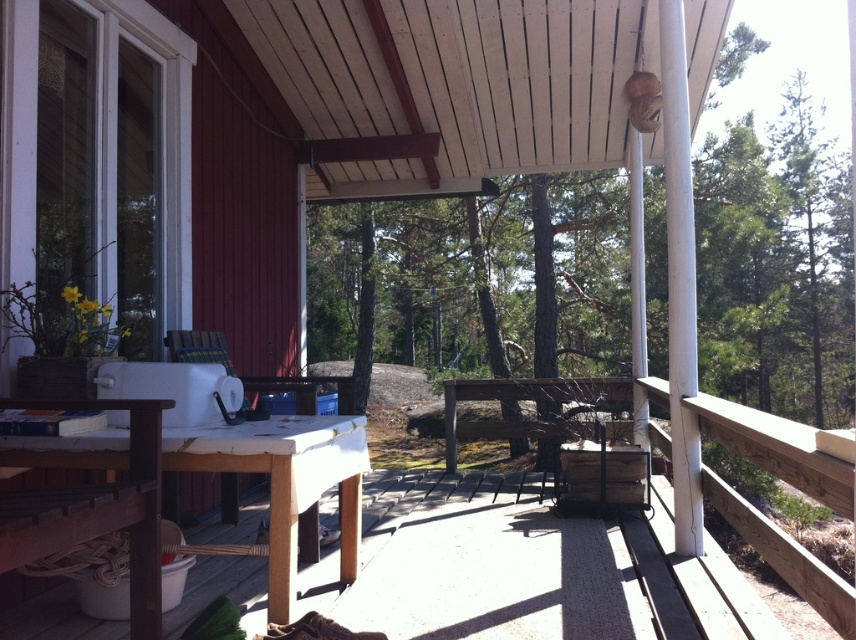
Based on the photo, between wooden table at center and white matte table at lower left, which one has more height?

Standing taller between the two is white matte table at lower left.

Between point (300, 486) and point (290, 456), which one is positioned in front?

Point (290, 456)

What are the coordinates of `wooden table at center` in the screenshot? It's located at (284, 481).